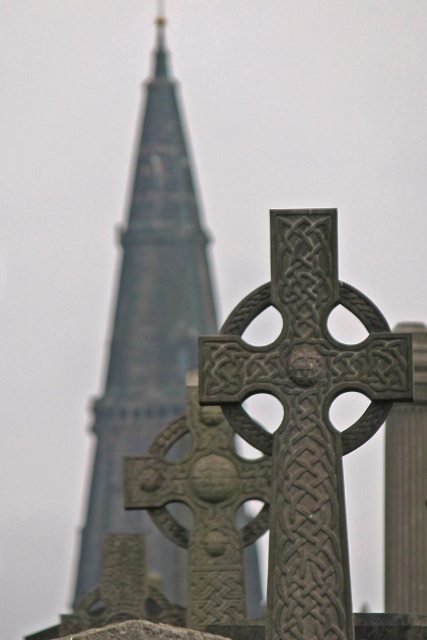
Question: Does gray stone tower at upper left have a greater width compared to carved stone cross at center?

Choices:
 (A) yes
 (B) no

Answer: (A)

Question: Does dark gray stone cross at center appear on the left side of gray stone tower at upper left?

Choices:
 (A) yes
 (B) no

Answer: (B)

Question: Observing the image, what is the correct spatial positioning of dark gray stone cross at center in reference to gray stone tower at upper left?

Choices:
 (A) above
 (B) below

Answer: (B)

Question: Which object is the farthest from the dark gray stone cross at center?

Choices:
 (A) carved stone cross at center
 (B) gray stone tower at upper left

Answer: (B)

Question: Which of these objects is positioned farthest from the gray stone tower at upper left?

Choices:
 (A) carved stone cross at center
 (B) dark gray stone cross at center

Answer: (B)

Question: Which of these objects is positioned closest to the dark gray stone cross at center?

Choices:
 (A) gray stone tower at upper left
 (B) carved stone cross at center

Answer: (B)